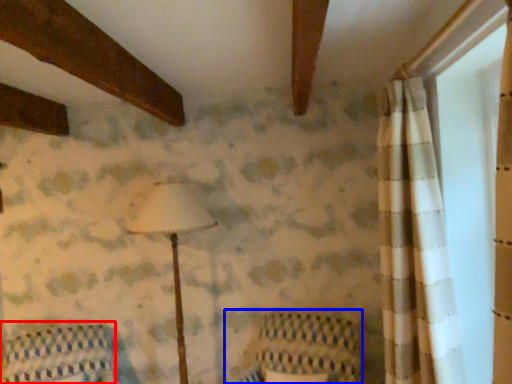
Question: Among these objects, which one is farthest to the camera, furniture (highlighted by a red box) or armchair (highlighted by a blue box)?

Choices:
 (A) furniture
 (B) armchair

Answer: (A)